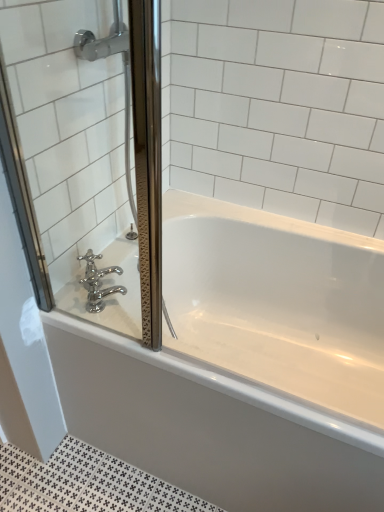
Question: Is polished chrome faucet at lower left oriented towards white glossy bathtub at center?

Choices:
 (A) yes
 (B) no

Answer: (B)

Question: From the image's perspective, is polished chrome faucet at lower left located above white glossy bathtub at center?

Choices:
 (A) no
 (B) yes

Answer: (B)

Question: Can we say polished chrome faucet at lower left lies outside white glossy bathtub at center?

Choices:
 (A) yes
 (B) no

Answer: (A)

Question: Can you confirm if polished chrome faucet at lower left is positioned to the right of white glossy bathtub at center?

Choices:
 (A) no
 (B) yes

Answer: (A)

Question: Are polished chrome faucet at lower left and white glossy bathtub at center located far from each other?

Choices:
 (A) no
 (B) yes

Answer: (A)

Question: Can you confirm if polished chrome faucet at lower left is thinner than white glossy bathtub at center?

Choices:
 (A) no
 (B) yes

Answer: (B)

Question: Is white glossy bathtub at center located outside clear glass screen door at left?

Choices:
 (A) yes
 (B) no

Answer: (A)

Question: Does white glossy bathtub at center come in front of clear glass screen door at left?

Choices:
 (A) yes
 (B) no

Answer: (B)

Question: From the image's perspective, is white glossy bathtub at center located beneath clear glass screen door at left?

Choices:
 (A) no
 (B) yes

Answer: (B)

Question: Considering the relative sizes of white glossy bathtub at center and clear glass screen door at left in the image provided, is white glossy bathtub at center thinner than clear glass screen door at left?

Choices:
 (A) no
 (B) yes

Answer: (A)

Question: Is white glossy bathtub at center far away from clear glass screen door at left?

Choices:
 (A) no
 (B) yes

Answer: (A)

Question: Is white glossy bathtub at center positioned behind clear glass screen door at left?

Choices:
 (A) yes
 (B) no

Answer: (A)

Question: Is clear glass screen door at left smaller than polished chrome faucet at lower left?

Choices:
 (A) no
 (B) yes

Answer: (A)